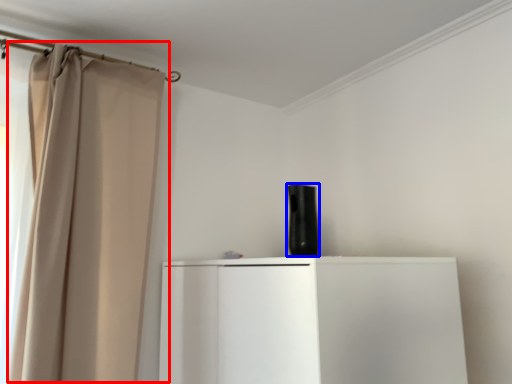
Question: Which point is closer to the camera, curtain (highlighted by a red box) or appliance (highlighted by a blue box)?

Choices:
 (A) curtain
 (B) appliance

Answer: (A)